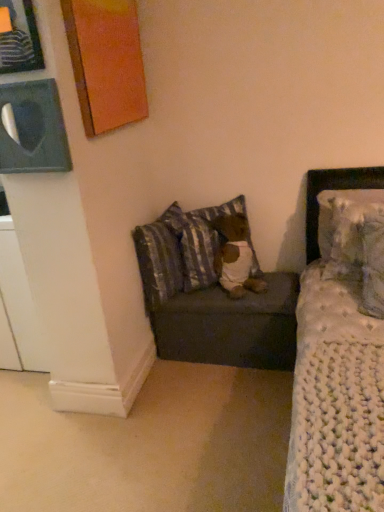
Question: Is orange painted wood picture frame at upper left, arranged as the second picture frame when viewed from the front, further to camera compared to striped fabric pillow at lower center, the 2th pillow positioned from the left?

Choices:
 (A) yes
 (B) no

Answer: (B)

Question: Is orange painted wood picture frame at upper left, arranged as the second picture frame when viewed from the front, oriented away from striped fabric pillow at lower center, the 2th pillow positioned from the left?

Choices:
 (A) yes
 (B) no

Answer: (B)

Question: From a real-world perspective, is orange painted wood picture frame at upper left, arranged as the second picture frame when viewed from the front, over striped fabric pillow at lower center, which ranks as the third pillow in right-to-left order?

Choices:
 (A) no
 (B) yes

Answer: (B)

Question: Does orange painted wood picture frame at upper left, arranged as the second picture frame when viewed from the front, turn towards striped fabric pillow at lower center, which ranks as the third pillow in right-to-left order?

Choices:
 (A) yes
 (B) no

Answer: (B)

Question: Considering the relative sizes of orange painted wood picture frame at upper left, arranged as the second picture frame when viewed from the front, and striped fabric pillow at lower center, which ranks as the third pillow in right-to-left order, in the image provided, is orange painted wood picture frame at upper left, arranged as the second picture frame when viewed from the front, thinner than striped fabric pillow at lower center, which ranks as the third pillow in right-to-left order,?

Choices:
 (A) yes
 (B) no

Answer: (A)

Question: From the image's perspective, does orange painted wood picture frame at upper left, arranged as the second picture frame when viewed from the front, appear higher than striped fabric pillow at lower center, which ranks as the third pillow in right-to-left order?

Choices:
 (A) yes
 (B) no

Answer: (A)

Question: Is orange painted wood picture frame at upper left, positioned as the second picture frame in back-to-front order, aimed at brown plush bear at center?

Choices:
 (A) yes
 (B) no

Answer: (B)

Question: Does orange painted wood picture frame at upper left, arranged as the second picture frame when viewed from the front, have a greater width compared to brown plush bear at center?

Choices:
 (A) yes
 (B) no

Answer: (B)

Question: Does orange painted wood picture frame at upper left, positioned as the second picture frame in back-to-front order, have a lesser width compared to brown plush bear at center?

Choices:
 (A) no
 (B) yes

Answer: (B)

Question: From the image's perspective, is orange painted wood picture frame at upper left, arranged as the second picture frame when viewed from the front, above brown plush bear at center?

Choices:
 (A) yes
 (B) no

Answer: (A)

Question: Is orange painted wood picture frame at upper left, positioned as the second picture frame in back-to-front order, outside brown plush bear at center?

Choices:
 (A) yes
 (B) no

Answer: (A)

Question: Does orange painted wood picture frame at upper left, positioned as the second picture frame in back-to-front order, have a larger size compared to brown plush bear at center?

Choices:
 (A) no
 (B) yes

Answer: (B)

Question: Is striped fabric pillow at lower center, the 2th pillow positioned from the left, at the left side of white knitted pillow at upper right, placed as the second pillow when sorted from right to left?

Choices:
 (A) yes
 (B) no

Answer: (A)